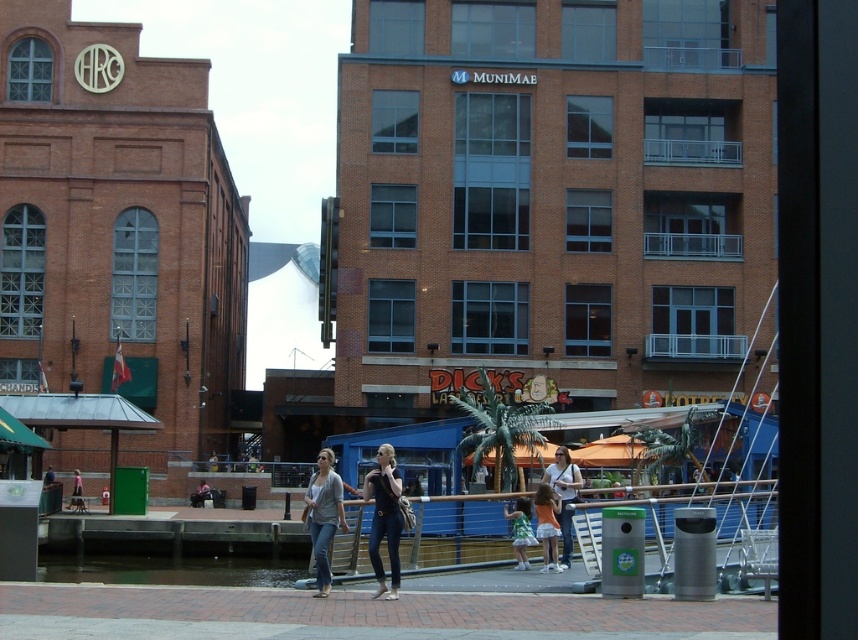
You are a photographer planning to capture a wide shot of the waterfront scene. You want to ensure both the clear water at lower center and the light pink fabric at lower left are visible in your frame. Considering their sizes, which object will occupy more space in the photo?

The clear water at lower center will occupy more space in the photo because it has a larger size compared to the light pink fabric at lower left.

You are standing at the waterfront promenade and want to take a photo of both point (100,572) and point (553,516). Which point should you focus on first to ensure both are in the frame?

You should focus on point (100,572) first because it is closer to the camera than point (553,516), ensuring both points remain in the frame.

You are standing at the edge of the waterfront promenade and want to walk to the clear water at lower center. The walkway is 1.2 meters wide. Can you safely walk to the water without stepping into it?

The clear water at lower center is 49.35 meters away from the viewer. Since the walkway is only 1.2 meters wide, you can safely walk to the water without stepping into it as the distance is sufficient.